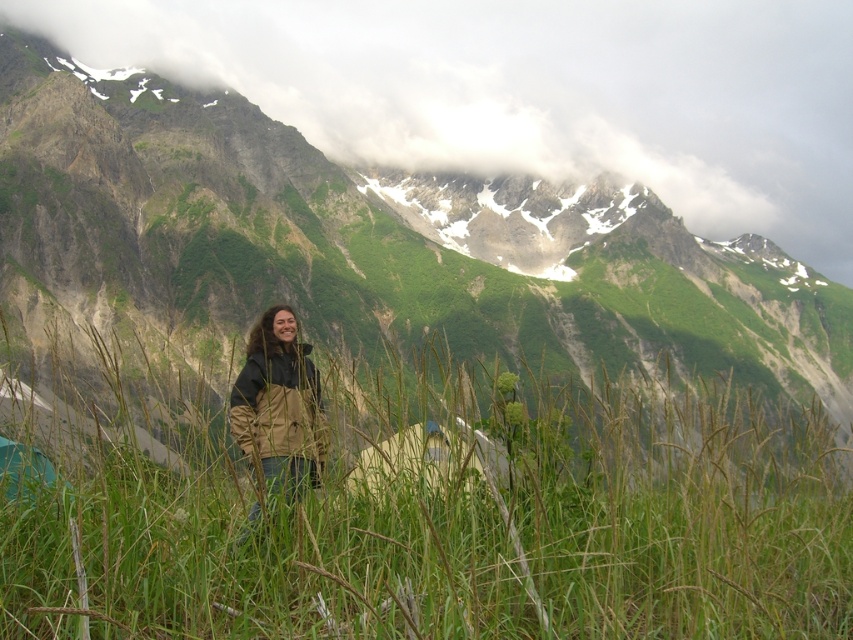
Question: Estimate the real-world distances between objects in this image. Which object is closer to the green fabric tent at lower left?

Choices:
 (A) green grassy at center
 (B) brown/cotton jacket at center

Answer: (B)

Question: Among these objects, which one is nearest to the camera?

Choices:
 (A) green grassy mountain at center
 (B) green grassy at center
 (C) brown/cotton jacket at center

Answer: (B)

Question: In this image, where is green grassy at center located relative to brown/cotton jacket at center?

Choices:
 (A) above
 (B) below

Answer: (B)

Question: Is white canvas tent at center to the left of green fabric tent at lower left from the viewer's perspective?

Choices:
 (A) yes
 (B) no

Answer: (B)

Question: Which object appears farthest from the camera in this image?

Choices:
 (A) brown/cotton jacket at center
 (B) white canvas tent at center
 (C) green grassy mountain at center
 (D) green grassy at center

Answer: (C)

Question: Can you confirm if green grassy at center is wider than green grassy mountain at center?

Choices:
 (A) yes
 (B) no

Answer: (B)